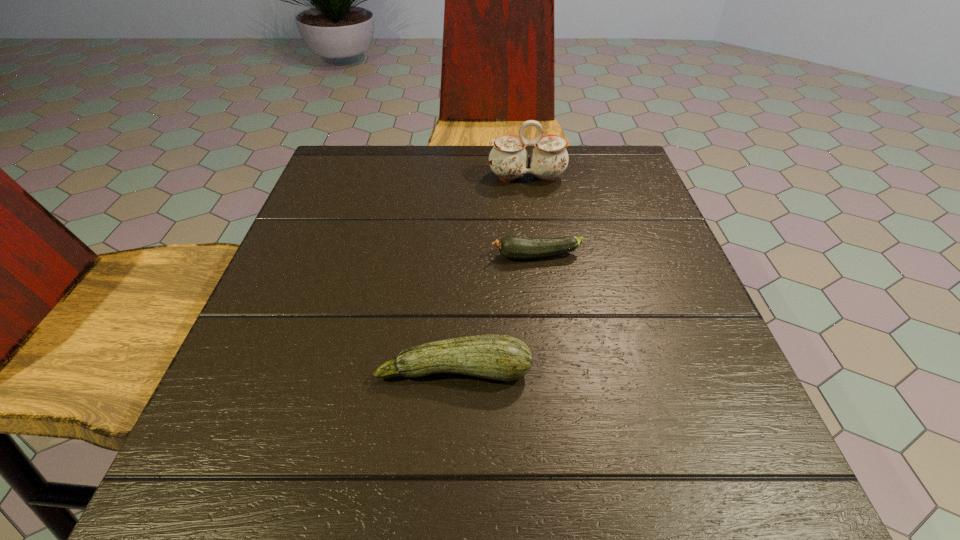
You are a GUI agent. You are given a task and a screenshot of the screen. Output one action in this format:
    pyautogui.click(x=<x>, y=<y>)
    Task: Click on the farthest object
    
    Given the screenshot: What is the action you would take?
    pyautogui.click(x=508, y=159)

The image size is (960, 540). Identify the location of chinaware. (508, 159).

Where is `the second tallest object`? Image resolution: width=960 pixels, height=540 pixels. the second tallest object is located at coordinates (501, 357).

Where is `the taller zucchini`? the taller zucchini is located at coordinates (501, 357).

The height and width of the screenshot is (540, 960). In order to click on the farther zucchini in this screenshot , I will do `click(512, 246)`.

The image size is (960, 540). Find the location of `the shortest object`. the shortest object is located at coordinates (512, 246).

The image size is (960, 540). In order to click on vacant space located by the handle of the chinaware in this screenshot , I will do pyautogui.click(x=546, y=313).

You are a GUI agent. You are given a task and a screenshot of the screen. Output one action in this format:
    pyautogui.click(x=<x>, y=<y>)
    Task: Click on the free region located at the stem end of the second shortest object
    Image resolution: width=960 pixels, height=540 pixels.
    Given the screenshot: What is the action you would take?
    pyautogui.click(x=448, y=487)

The height and width of the screenshot is (540, 960). I want to click on vacant space positioned at the blossom end of the shortest object, so click(436, 256).

This screenshot has width=960, height=540. Find the location of `vacant space located at the blossom end of the shortest object`. vacant space located at the blossom end of the shortest object is located at coordinates (320, 256).